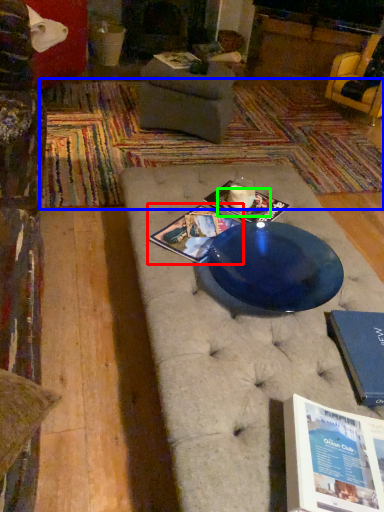
Question: Which object is the closest to the magazine (highlighted by a red box)? Choose among these: mat (highlighted by a blue box) or plate (highlighted by a green box).

Choices:
 (A) mat
 (B) plate

Answer: (B)